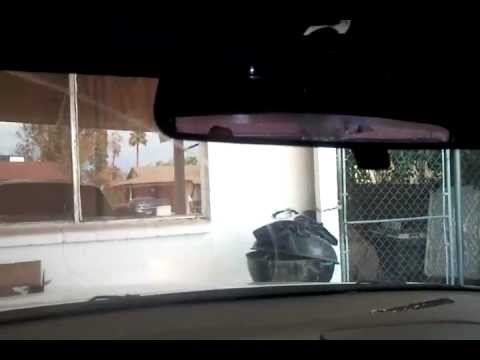
Locate an element on the screen. window is located at coordinates (116, 189).